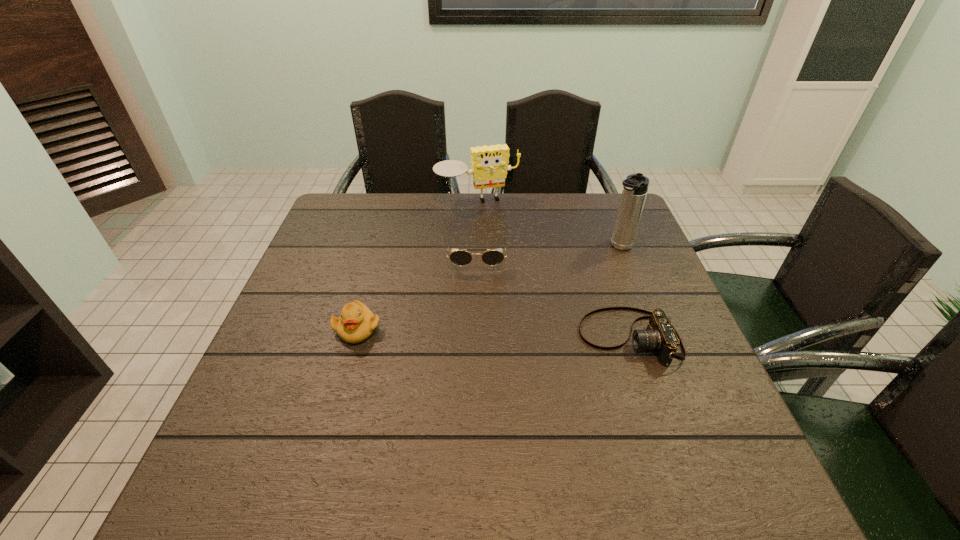
Where is `the leftmost object`? The image size is (960, 540). the leftmost object is located at coordinates (356, 323).

I want to click on the shortest object, so (x=660, y=335).

Locate an element on the screen. the tallest object is located at coordinates click(x=635, y=186).

Find the location of a particular element. sponge is located at coordinates (489, 166).

Find the location of a particular element. the fourth shortest object is located at coordinates (489, 166).

Find the location of a particular element. This screenshot has height=540, width=960. sunglasses is located at coordinates (460, 257).

Locate an element on the screen. The image size is (960, 540). vacant area situated 0.060m at the beak of the duckling is located at coordinates (347, 368).

Locate an element on the screen. free space located on the front-facing side of the camera is located at coordinates (484, 338).

The image size is (960, 540). What are the coordinates of `free location located on the front-facing side of the camera` in the screenshot? It's located at (405, 338).

Image resolution: width=960 pixels, height=540 pixels. Find the location of `vacant area situated 0.270m on the front-facing side of the camera`. vacant area situated 0.270m on the front-facing side of the camera is located at coordinates (462, 338).